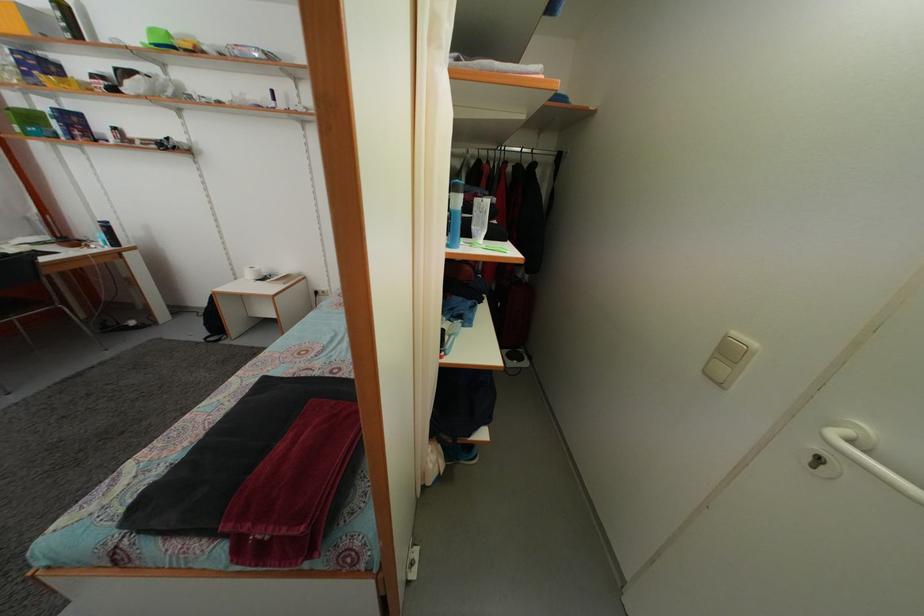
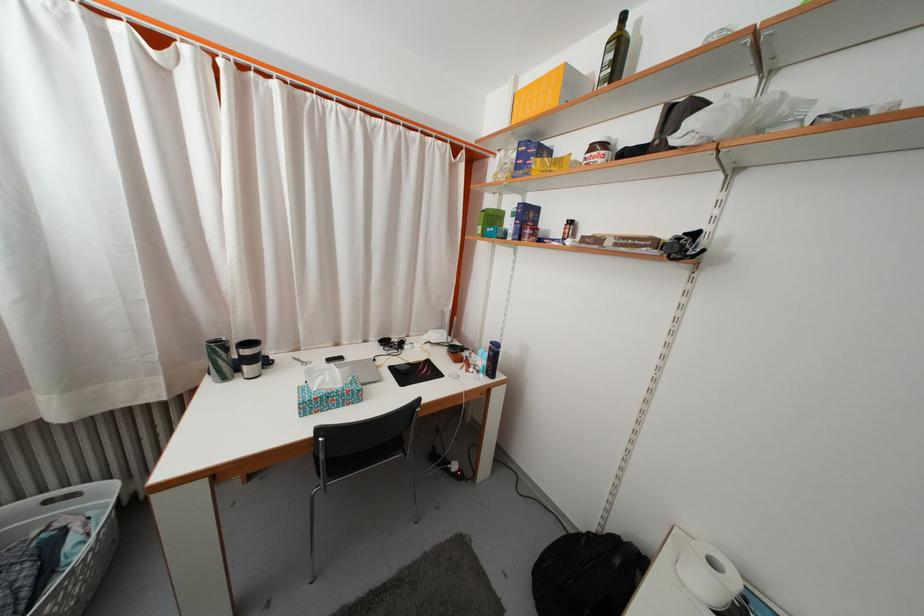
Locate, in the second image, the point that corresponds to point (38, 126) in the first image.

(500, 225)